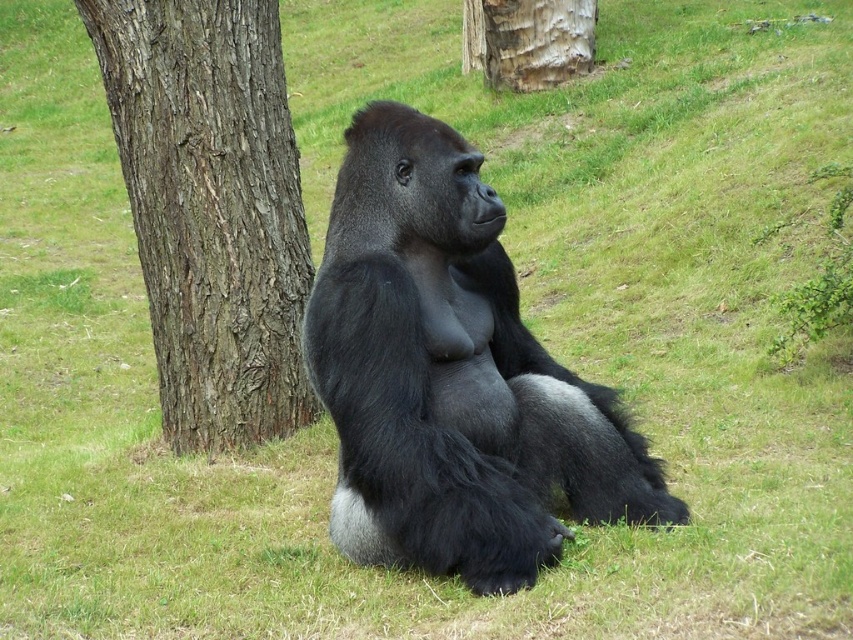
You are a hiker who wants to take a photo of both the brown rough bark tree at left and the gray textured bark at center. Which tree should you stand closer to in order to capture both in the same frame?

You should stand closer to the gray textured bark at center because the brown rough bark tree at left is positioned on the left side of it, so centering the gray textured bark at center will allow both trees to be in the frame.

You are standing in front of the gorilla and notice two points in the image. The first point is at coordinates point (421, 410) and the second point is at point (283, 230). Which of these points is closer to you?

Point (421, 410) is closer to the camera than point (283, 230).